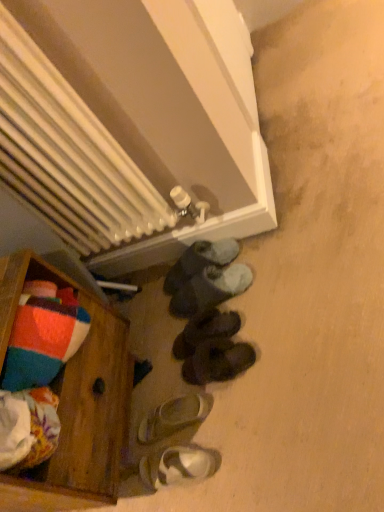
Image resolution: width=384 pixels, height=512 pixels. I want to click on free space that is to the left of dark gray suede slippers at lower center, which is the 5th footwear from bottom to top, so click(153, 335).